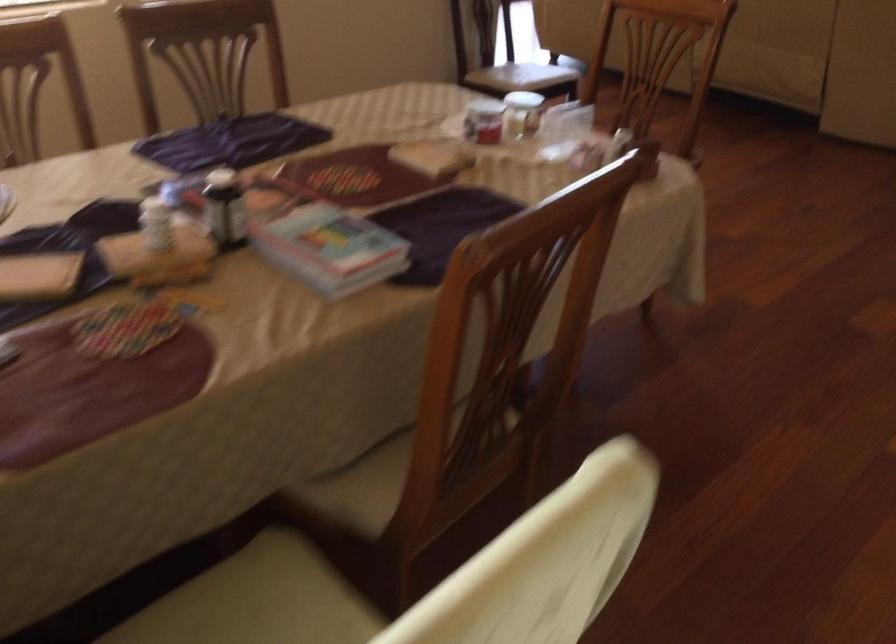
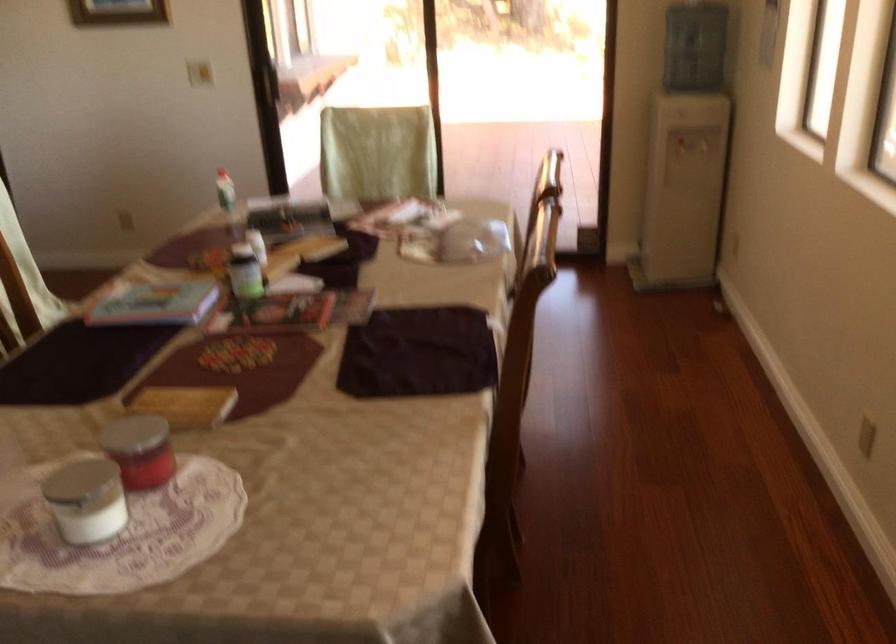
The point at [483,116] is marked in the first image. Where is the corresponding point in the second image?

(149, 458)